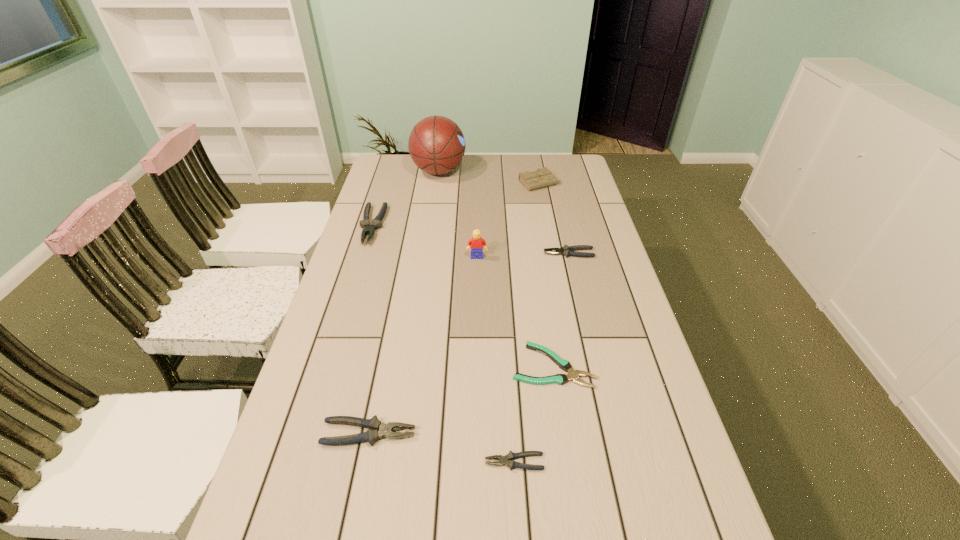
At what (x,y) coordinates should I click in order to perform the action: click on basketball. Please return your answer as a coordinate pair (x, y). Looking at the image, I should click on (436, 144).

This screenshot has width=960, height=540. I want to click on Lego, so click(x=476, y=243).

Find the location of a particular element. the seventh shortest object is located at coordinates (542, 177).

Locate an element on the screen. The width and height of the screenshot is (960, 540). green diary is located at coordinates (542, 177).

Where is `the biggest gray pliers`? The width and height of the screenshot is (960, 540). the biggest gray pliers is located at coordinates (376, 223).

You are a GUI agent. You are given a task and a screenshot of the screen. Output one action in this format:
    pyautogui.click(x=<x>, y=<y>)
    Task: Click on the sixth shortest object
    The image size is (960, 540).
    Given the screenshot: What is the action you would take?
    pyautogui.click(x=376, y=223)

Where is `the fourth farthest pliers`? the fourth farthest pliers is located at coordinates (377, 429).

Where is `the third smallest gray pliers`? the third smallest gray pliers is located at coordinates (377, 429).

Find the location of a particular element. Image resolution: width=960 pixels, height=540 pixels. the sixth tallest object is located at coordinates (566, 250).

The image size is (960, 540). I want to click on the third biggest gray pliers, so click(x=566, y=250).